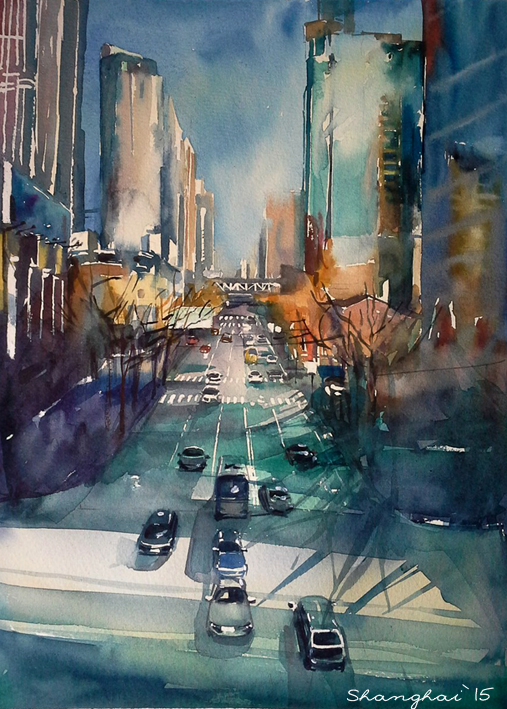
Where is `painting`? The height and width of the screenshot is (709, 507). painting is located at coordinates tap(476, 122).